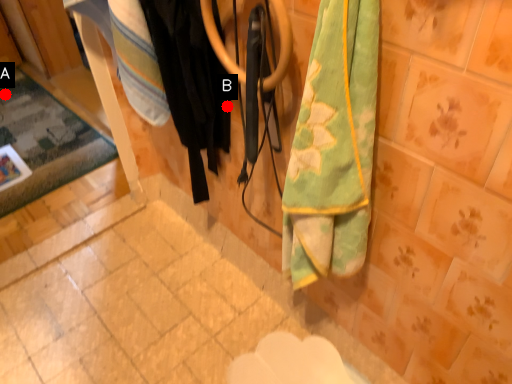
Question: Two points are circled on the image, labeled by A and B beside each circle. Which point appears closest to the camera in this image?

Choices:
 (A) A is closer
 (B) B is closer

Answer: (B)